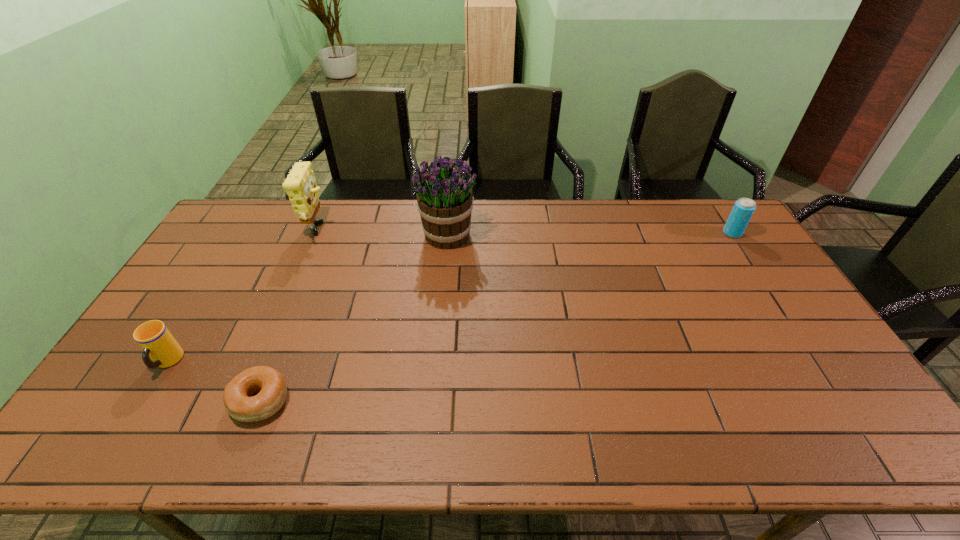
Identify the location of the tallest object. (444, 195).

Image resolution: width=960 pixels, height=540 pixels. I want to click on the second object from right to left, so click(x=444, y=195).

Image resolution: width=960 pixels, height=540 pixels. Find the location of `sponge`. sponge is located at coordinates click(300, 185).

Where is `soda can`? soda can is located at coordinates (743, 209).

The image size is (960, 540). Identify the location of cup. (157, 342).

Identify the location of the shortest object. (271, 385).

Image resolution: width=960 pixels, height=540 pixels. Identify the location of vacant space situated on the right of the second object from right to left. (500, 235).

This screenshot has height=540, width=960. Identify the location of blank space located 0.230m on the face of the fourth shortest object. (395, 232).

Locate an element on the screen. vacant space located on the front of the soda can is located at coordinates click(x=765, y=283).

Locate an element on the screen. This screenshot has width=960, height=540. vacant region located 0.190m on the side of the cup with the handle is located at coordinates (114, 450).